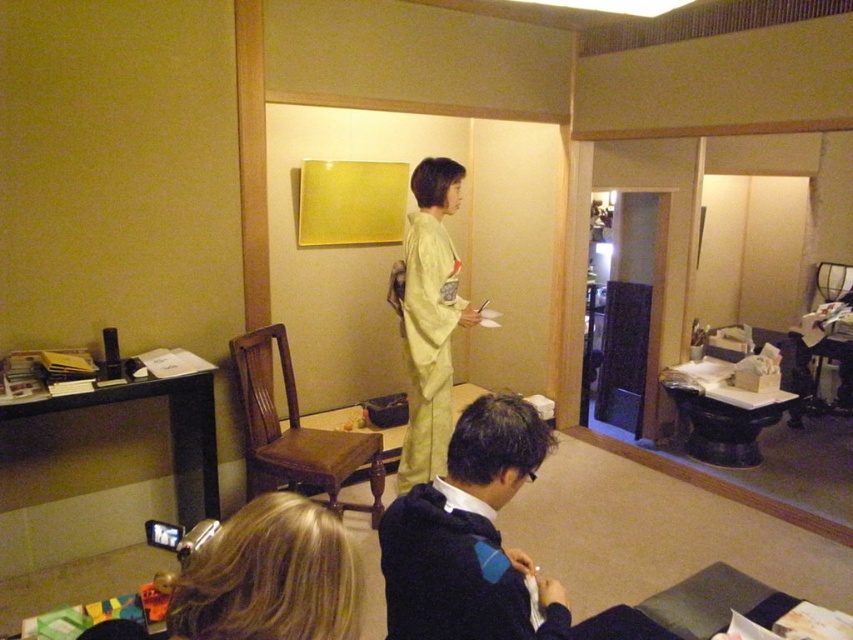
How far apart are dark blue sweater at lower center and light yellow silk kimono at center?

dark blue sweater at lower center is 5.12 feet from light yellow silk kimono at center.

Image resolution: width=853 pixels, height=640 pixels. Identify the location of dark blue sweater at lower center. (474, 579).

Is point (453, 552) positioned behind point (408, 230)?

That is False.

Image resolution: width=853 pixels, height=640 pixels. In order to click on dark blue sweater at lower center in this screenshot , I will do `click(474, 579)`.

Is point (486, 529) positioned behind point (229, 547)?

Yes, it is.

Who is higher up, dark blue sweater at lower center or blonde hair at lower center?

blonde hair at lower center is higher up.

Does point (460, 621) lie behind point (329, 596)?

Yes, point (460, 621) is behind point (329, 596).

The image size is (853, 640). Identify the location of dark blue sweater at lower center. (474, 579).

Is blonde hair at lower center further to camera compared to light yellow silk kimono at center?

That is False.

Does point (354, 605) lie in front of point (427, 236)?

Yes, it is.

The image size is (853, 640). Find the location of `blonde hair at lower center`. blonde hair at lower center is located at coordinates (270, 577).